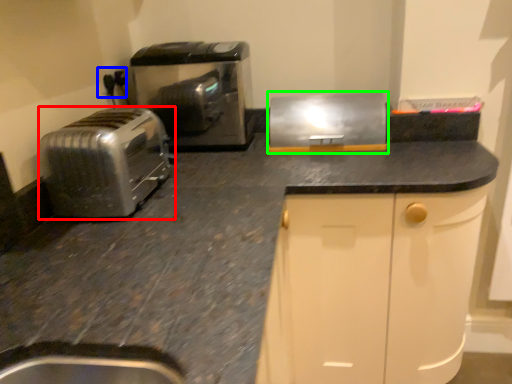
Question: Considering the real-world distances, which object is closest to toaster (highlighted by a red box)? electric outlet (highlighted by a blue box) or kitchen appliance (highlighted by a green box).

Choices:
 (A) electric outlet
 (B) kitchen appliance

Answer: (A)